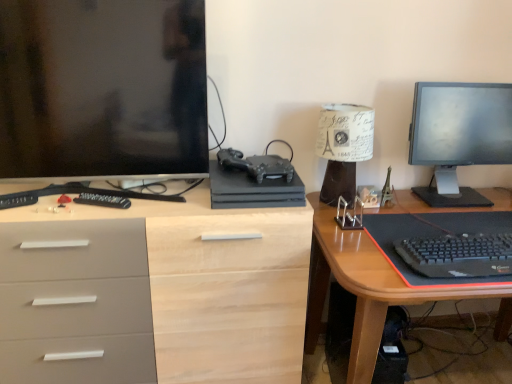
This screenshot has width=512, height=384. Find the location of `vacant space situated above matte wood desk at center, the first desk viewed from the left (from a real-world perspective)`. vacant space situated above matte wood desk at center, the first desk viewed from the left (from a real-world perspective) is located at coordinates (151, 197).